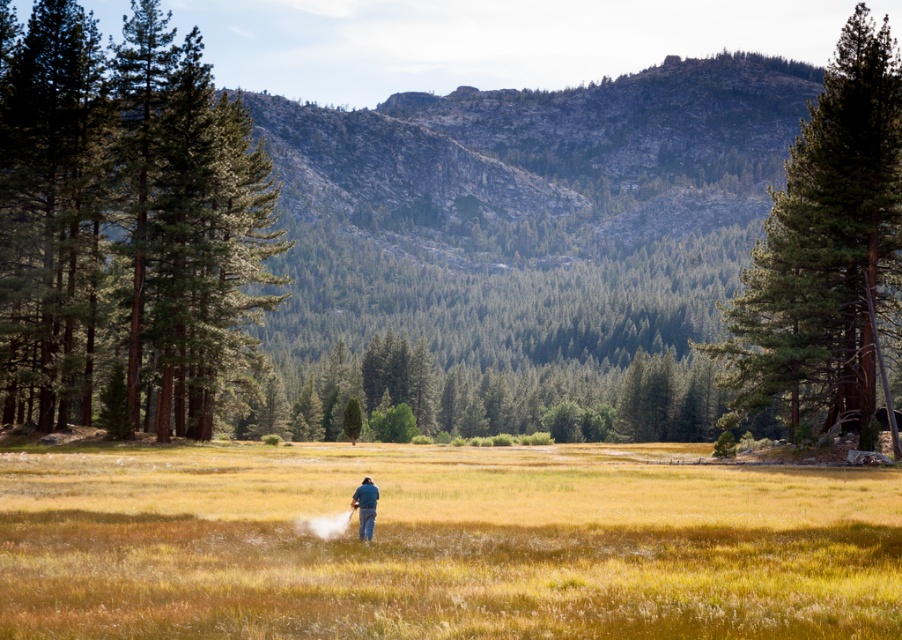
Question: Among these points, which one is nearest to the camera?

Choices:
 (A) (370, 483)
 (B) (49, 406)
 (C) (45, 605)

Answer: (C)

Question: Where is green textured tree at right located in relation to blue denim jeans at center in the image?

Choices:
 (A) above
 (B) below

Answer: (A)

Question: Which point appears closest to the camera in this image?

Choices:
 (A) (366, 516)
 (B) (845, 474)
 (C) (106, 225)
 (D) (795, 404)

Answer: (A)

Question: Is yellow grass at center thinner than green textured tree at right?

Choices:
 (A) no
 (B) yes

Answer: (B)

Question: Which point is farther to the camera?

Choices:
 (A) blue denim jeans at center
 (B) green textured pine trees at left
 (C) green textured tree at right

Answer: (B)

Question: Does green textured tree at right appear over blue denim jeans at center?

Choices:
 (A) no
 (B) yes

Answer: (B)